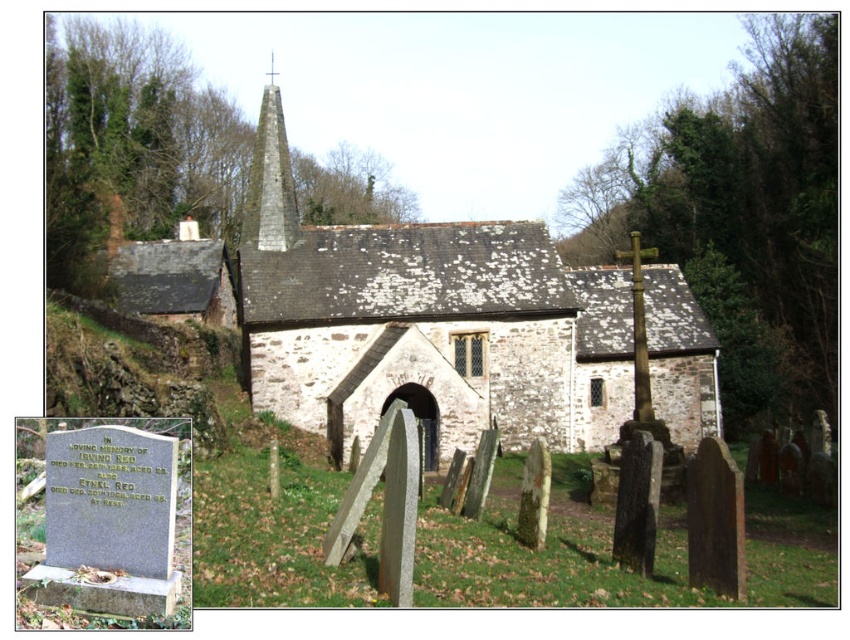
Looking at this image, you are standing in front of the stone church at center and want to take a photo of the smooth stone spire at center. Since the spire is part of the church, do you need to move closer or farther away to focus on the spire alone?

The stone church at center is closer to the viewer than the smooth stone spire at center. To focus on the spire alone, you need to move farther away so that the church doesn t block the view of the spire.

You are standing in the graveyard looking towards the stone church at center and the smooth stone spire at center. Which one appears taller from your viewpoint?

The smooth stone spire at center appears taller than the stone church at center because the stone church at center is shorter than the smooth stone spire at center.